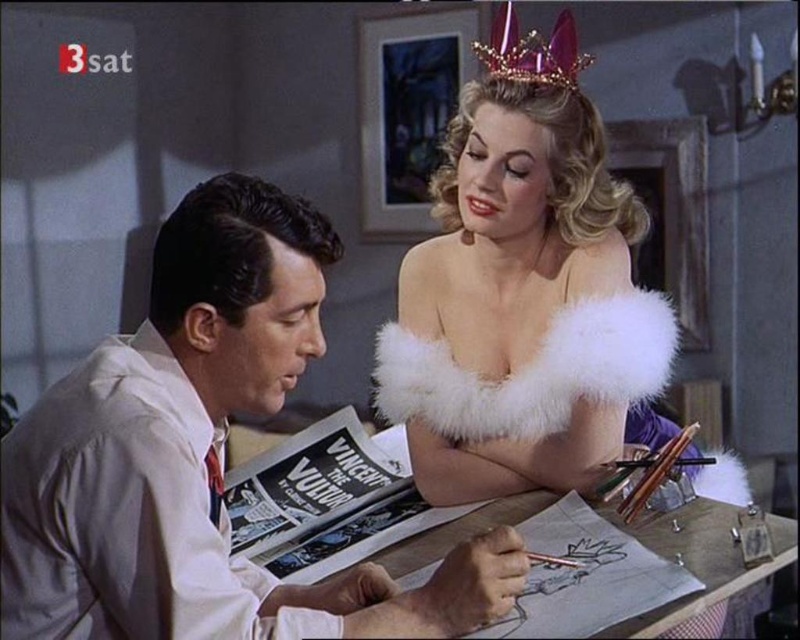
Question: Among these points, which one is farthest from the camera?

Choices:
 (A) (530, 35)
 (B) (132, 557)
 (C) (580, 97)

Answer: (A)

Question: Does white satin shirt at left have a greater width compared to white fur arm band at upper right?

Choices:
 (A) no
 (B) yes

Answer: (B)

Question: Which point is farther to the camera?

Choices:
 (A) white satin shirt at left
 (B) purple metallic crown at upper center
 (C) white fur arm band at upper right

Answer: (B)

Question: Which object is closer to the camera taking this photo?

Choices:
 (A) white fur arm band at upper right
 (B) white satin shirt at left

Answer: (B)

Question: Can you confirm if white satin shirt at left is positioned to the right of white fur arm band at upper right?

Choices:
 (A) yes
 (B) no

Answer: (B)

Question: Can you confirm if white fur arm band at upper right is bigger than purple metallic crown at upper center?

Choices:
 (A) no
 (B) yes

Answer: (B)